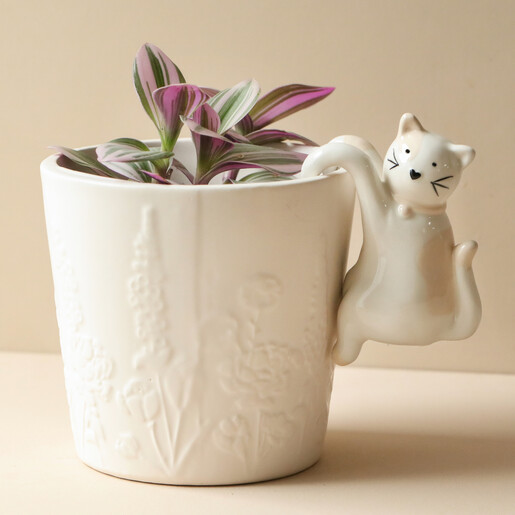
Locate an element on the screen. Image resolution: width=515 pixels, height=515 pixels. porcelain pot is located at coordinates (254, 389).